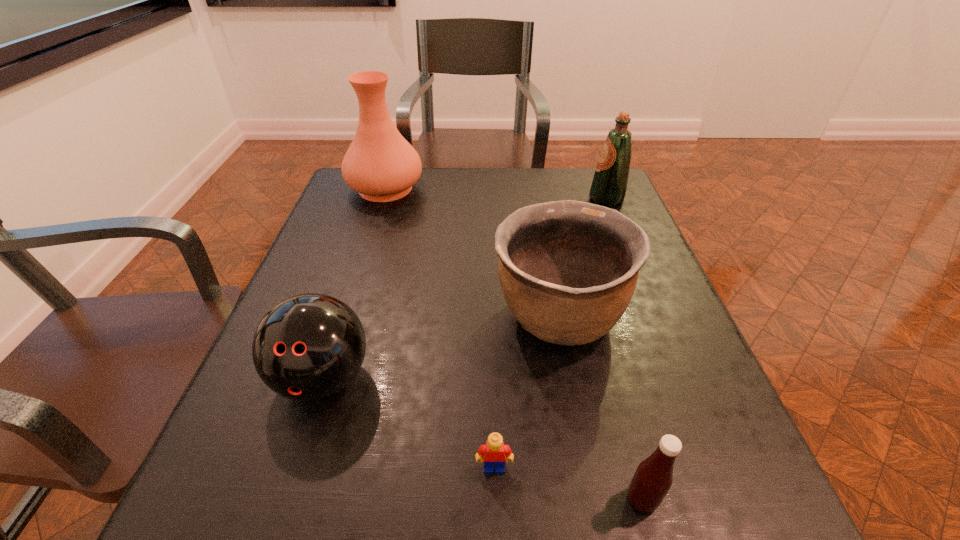
You are a GUI agent. You are given a task and a screenshot of the screen. Output one action in this format:
    pyautogui.click(x=<x>, y=<y>)
    Task: Click on the vacant area located on the front-facing side of the fifth shortest object
    This screenshot has width=960, height=540.
    Given the screenshot: What is the action you would take?
    pyautogui.click(x=493, y=199)

The height and width of the screenshot is (540, 960). In order to click on vacant space situated 0.200m on the front-facing side of the fifth shortest object in this screenshot , I will do `click(516, 199)`.

Locate an element on the screen. The image size is (960, 540). vacant space located on the front of the pottery is located at coordinates (573, 395).

This screenshot has height=540, width=960. Identify the location of blank space located 0.110m on the surface of the bowling ball near the finger holes. (286, 495).

Identify the location of vacant space located 0.210m on the back of the Tabasco sauce. The image size is (960, 540). (606, 365).

Locate an element on the screen. This screenshot has height=540, width=960. vacant space situated 0.060m on the face of the second nearest object is located at coordinates (495, 519).

Locate an element on the screen. vase positioned at the far edge is located at coordinates (380, 164).

Find the location of a particular element. This screenshot has width=960, height=540. olive oil that is at the far edge is located at coordinates (609, 185).

The height and width of the screenshot is (540, 960). What are the coordinates of `object located at the near edge` in the screenshot? It's located at (653, 478).

Identify the location of vase that is at the left edge. Image resolution: width=960 pixels, height=540 pixels. (380, 164).